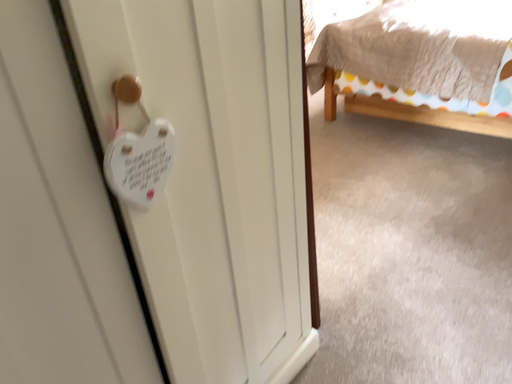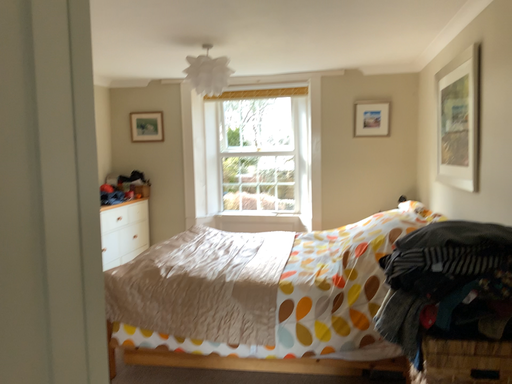
Question: Which way did the camera rotate in the video?

Choices:
 (A) rotated downward
 (B) rotated upward

Answer: (B)